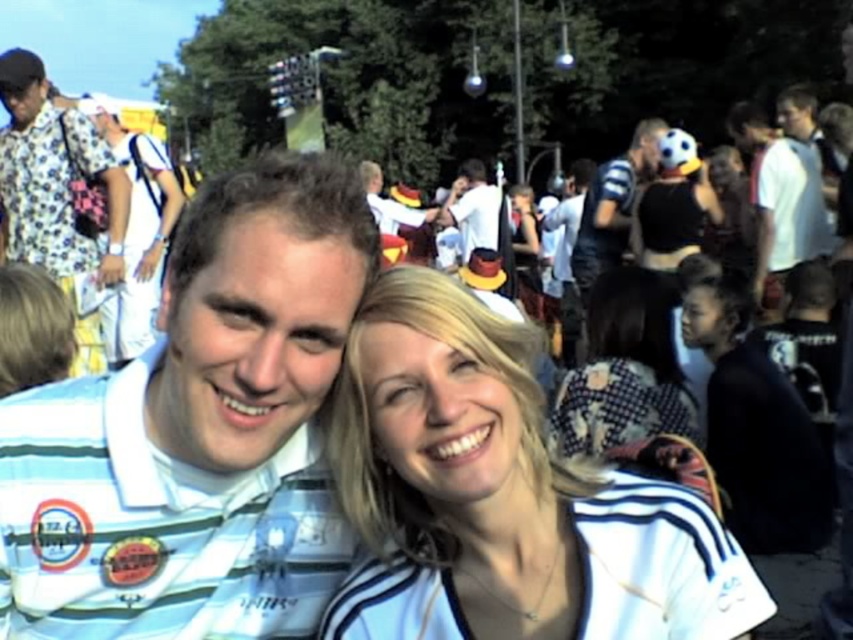
Question: Which of the following is the farthest from the observer?

Choices:
 (A) (764, 289)
 (B) (120, 592)
 (C) (36, 125)
 (D) (138, 147)

Answer: (D)

Question: Is white matte jacket at center positioned before striped fabric scarf at center?

Choices:
 (A) no
 (B) yes

Answer: (B)

Question: Does striped fabric scarf at center appear on the left side of white cotton shirt at left?

Choices:
 (A) no
 (B) yes

Answer: (A)

Question: Can you confirm if white matte shirt at upper right is bigger than white matte soccer ball at center?

Choices:
 (A) no
 (B) yes

Answer: (A)

Question: Which point appears farthest from the camera in this image?

Choices:
 (A) (506, 221)
 (B) (669, 440)
 (C) (723, 284)

Answer: (A)

Question: Estimate the real-world distances between objects in this image. Which object is farther from the striped fabric scarf at center?

Choices:
 (A) white striped polo shirt at center
 (B) white matte shirt at upper right

Answer: (A)